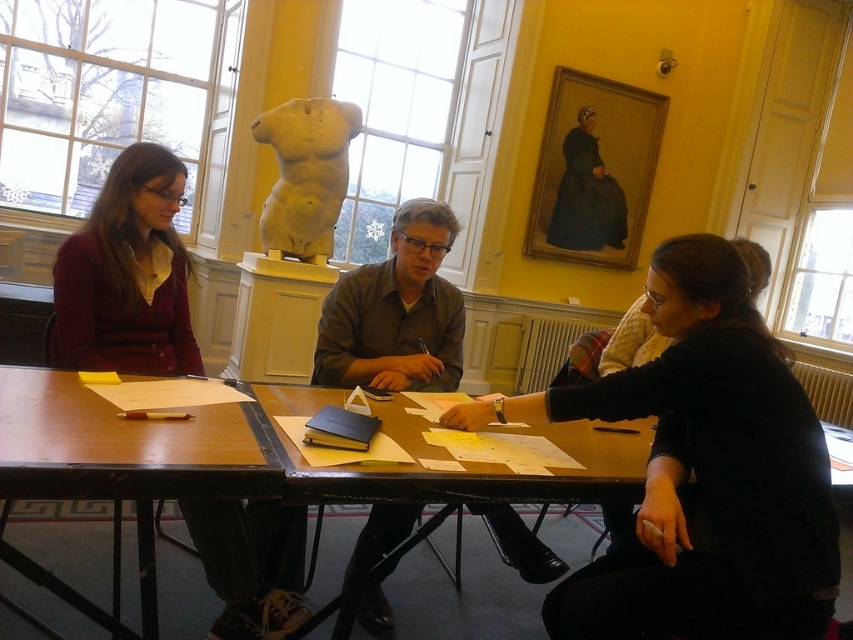
Question: Among these objects, which one is nearest to the camera?

Choices:
 (A) black matte sweater at lower right
 (B) brown wooden table at lower left
 (C) wooden table at center
 (D) dark blue fabric dress at upper center

Answer: (B)

Question: Can you confirm if black matte sweater at lower right is wider than matte maroon sweater at left?

Choices:
 (A) yes
 (B) no

Answer: (A)

Question: Which point is farther to the camera?

Choices:
 (A) (595, 600)
 (B) (607, 497)
 (C) (296, 131)
 (D) (566, 138)

Answer: (D)

Question: Where is black matte sweater at lower right located in relation to matte brown shirt at center in the image?

Choices:
 (A) right
 (B) left

Answer: (A)

Question: Observing the image, what is the correct spatial positioning of brown wooden table at lower left in reference to matte brown shirt at center?

Choices:
 (A) left
 (B) right

Answer: (A)

Question: Which point is farther from the camera taking this photo?

Choices:
 (A) (332, 180)
 (B) (370, 276)

Answer: (A)